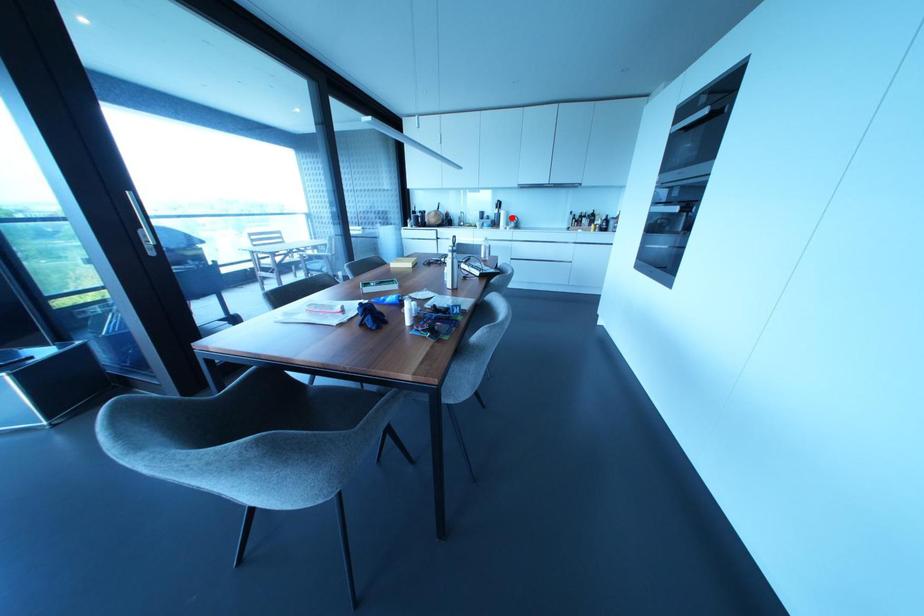
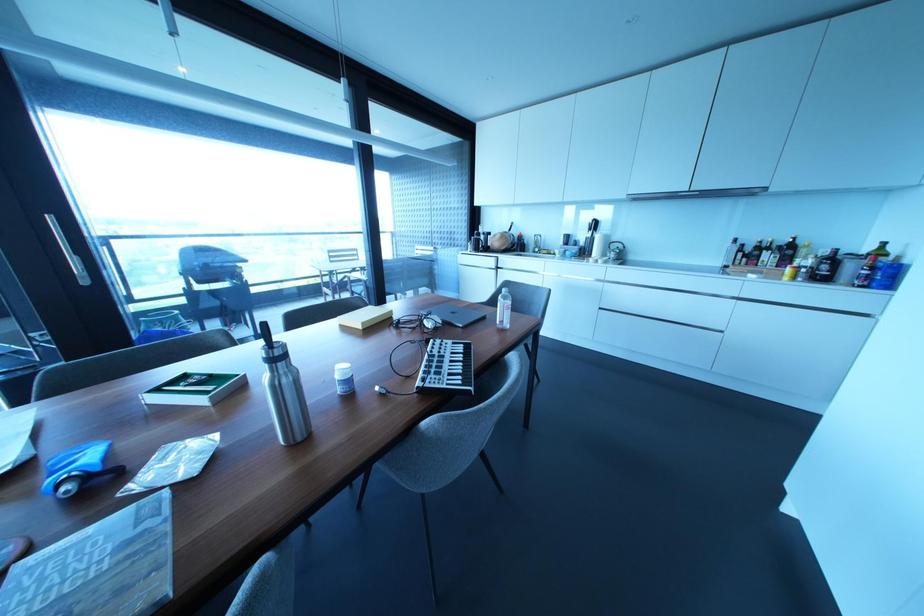
Find the pixel in the second image that matches the highlighted location in the first image.

(614, 245)